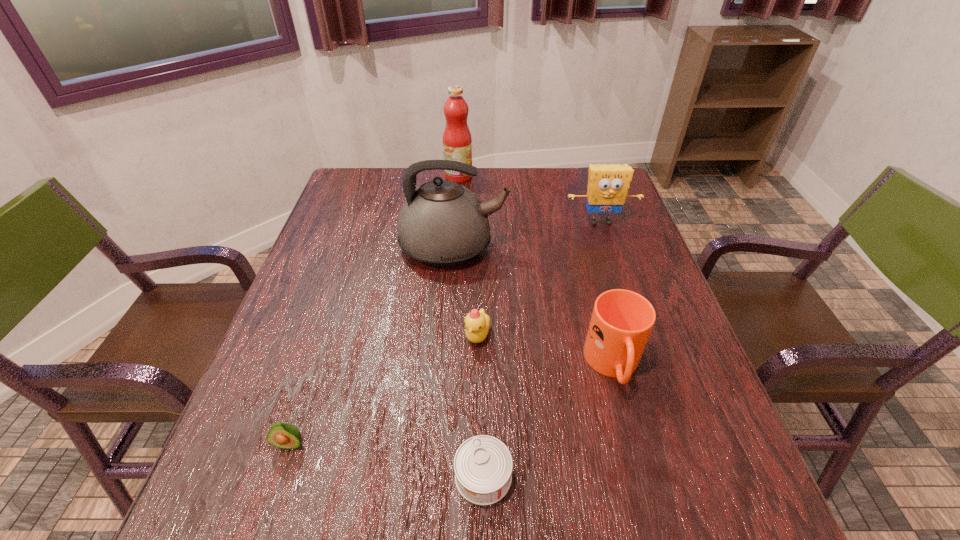
Where is `vacant region at the left edge of the desktop`? Image resolution: width=960 pixels, height=540 pixels. vacant region at the left edge of the desktop is located at coordinates (302, 286).

In the image, there is a desktop. Identify the location of vacant space at the right edge. This screenshot has height=540, width=960. tap(616, 228).

Locate an element on the screen. vacant region at the far left corner of the desktop is located at coordinates (337, 197).

The height and width of the screenshot is (540, 960). In order to click on vacant space at the far right corner of the desktop in this screenshot , I will do `click(586, 200)`.

Identify the location of vacant space at the near right corner of the desktop. (663, 513).

You are a GUI agent. You are given a task and a screenshot of the screen. Output one action in this format:
    pyautogui.click(x=<x>, y=<y>)
    Task: Click on the empty location between the avocado and the duckling
    
    Given the screenshot: What is the action you would take?
    pyautogui.click(x=384, y=390)

Where is `vacant space in between the fifth shortest object and the farthest object`? Image resolution: width=960 pixels, height=540 pixels. vacant space in between the fifth shortest object and the farthest object is located at coordinates (530, 199).

Where is `empty space that is in between the fourth shortest object and the can`? The image size is (960, 540). empty space that is in between the fourth shortest object and the can is located at coordinates point(548,421).

Locate an element on the screen. empty location between the kettle and the avocado is located at coordinates (372, 346).

Find the location of a particular element. The width and height of the screenshot is (960, 540). vacant space that is in between the shortest object and the mug is located at coordinates (548, 421).